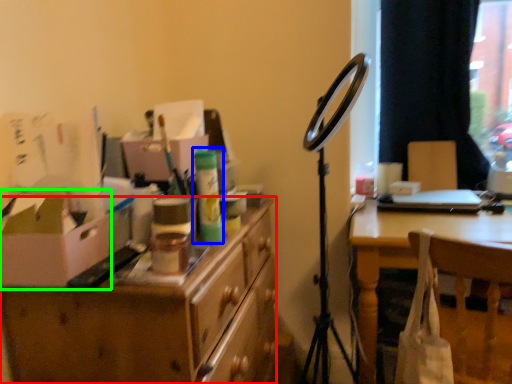
Question: Considering the real-world distances, which object is farthest from desk (highlighted by a red box)? toiletry (highlighted by a blue box) or cardboard box (highlighted by a green box)?

Choices:
 (A) toiletry
 (B) cardboard box

Answer: (A)